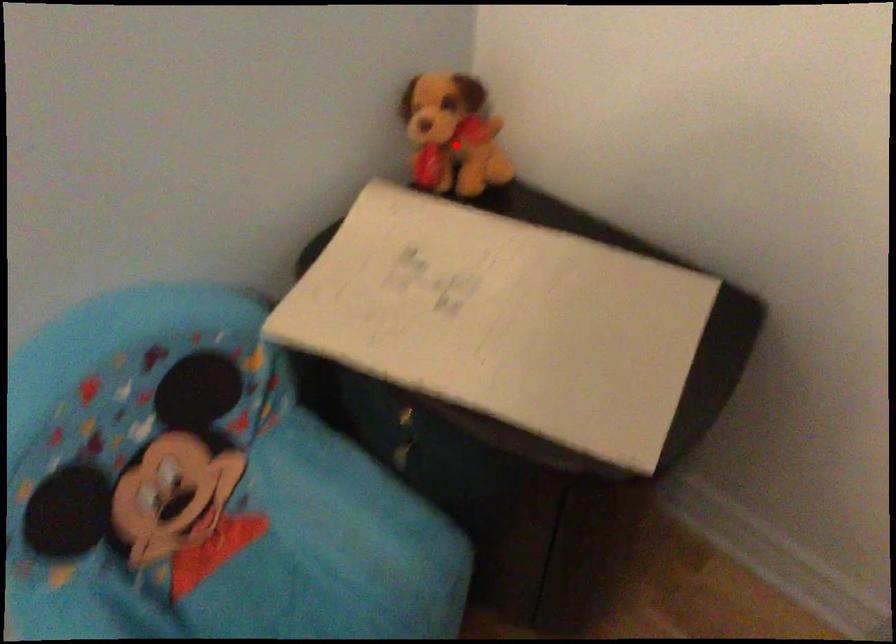
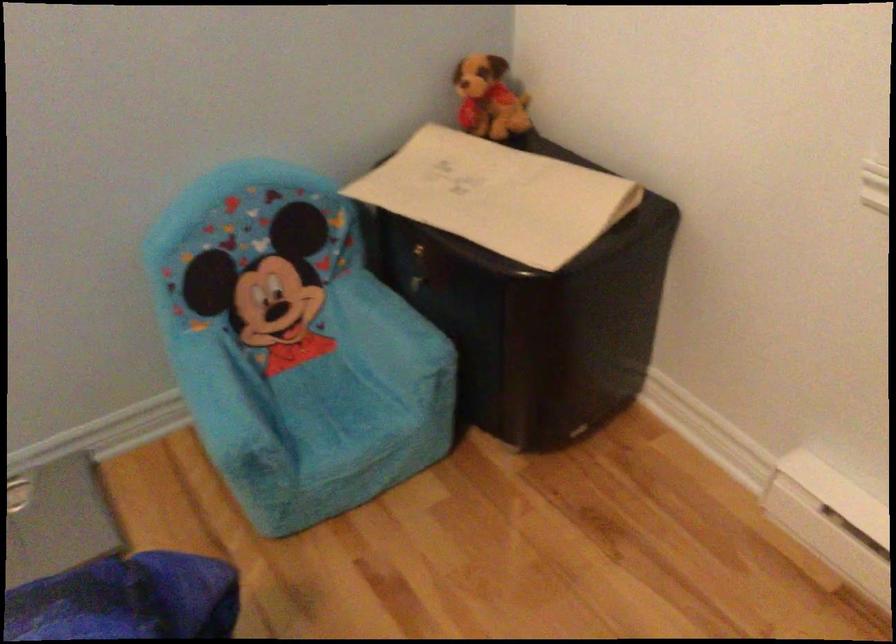
The point at the highlighted location is marked in the first image. Where is the corresponding point in the second image?

(488, 99)